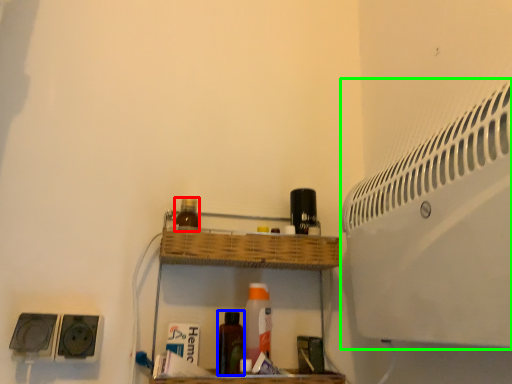
Question: Based on their relative distances, which object is farther from bottle (highlighted by a red box)? Choose from bottle (highlighted by a blue box) and air conditioning (highlighted by a green box).

Choices:
 (A) bottle
 (B) air conditioning

Answer: (B)